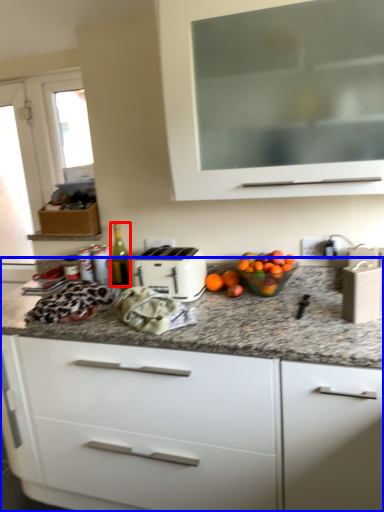
Question: Which of the following is the farthest to the observer, bottle (highlighted by a red box) or cabinetry (highlighted by a blue box)?

Choices:
 (A) bottle
 (B) cabinetry

Answer: (A)